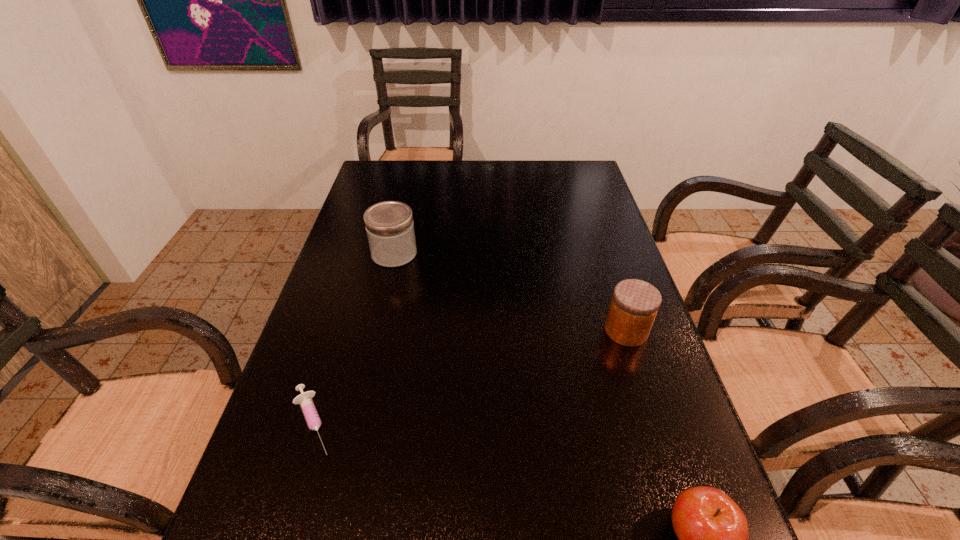
Where is `syringe present at the left edge`? The height and width of the screenshot is (540, 960). syringe present at the left edge is located at coordinates (308, 408).

Where is `object located in the right edge section of the desktop`? object located in the right edge section of the desktop is located at coordinates (635, 303).

In the image, there is a desktop. Identify the location of vacant region at the far edge. (419, 172).

I want to click on blank space at the left edge of the desktop, so click(348, 436).

Locate an element on the screen. Image resolution: width=960 pixels, height=540 pixels. vacant space at the right edge is located at coordinates coord(634,528).

Identify the location of vacant space at the far left corner. (369, 169).

The height and width of the screenshot is (540, 960). In the image, there is a desktop. Identify the location of free space at the far right corner. (576, 170).

This screenshot has height=540, width=960. Identify the location of free spot between the right jar and the farther jar. (510, 292).

Identify the location of free space between the syringe and the third nearest object. (469, 376).

You are a GUI agent. You are given a task and a screenshot of the screen. Output one action in this format:
    pyautogui.click(x=<x>, y=<y>)
    Task: Click on the free spot between the shortest object and the third nearest object
    
    Given the screenshot: What is the action you would take?
    click(469, 376)